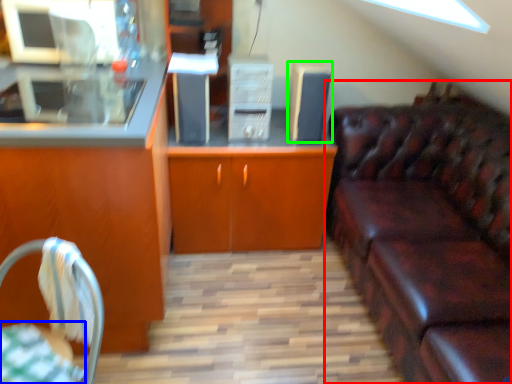
Question: Estimate the real-world distances between objects in this image. Which object is farther from studio couch (highlighted by a red box), tablecloth (highlighted by a blue box) or appliance (highlighted by a green box)?

Choices:
 (A) tablecloth
 (B) appliance

Answer: (A)